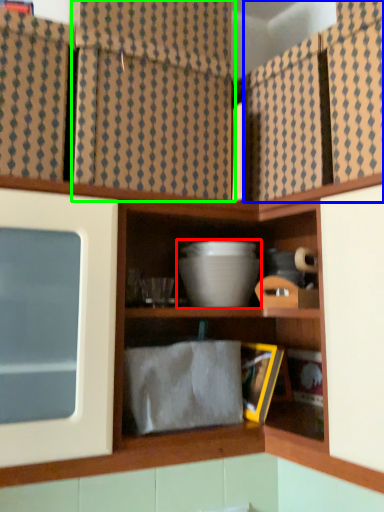
Question: Based on their relative distances, which object is nearer to mixing bowl (highlighted by a red box)? Choose from cabinet (highlighted by a blue box) and curtain (highlighted by a green box).

Choices:
 (A) cabinet
 (B) curtain

Answer: (A)